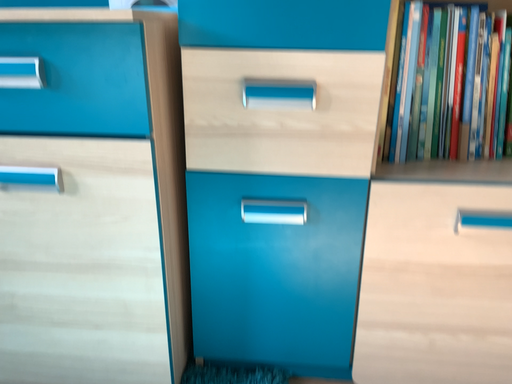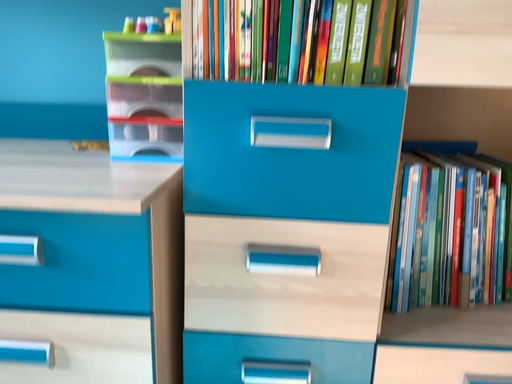
Question: Which way did the camera rotate in the video?

Choices:
 (A) rotated downward
 (B) rotated upward

Answer: (B)